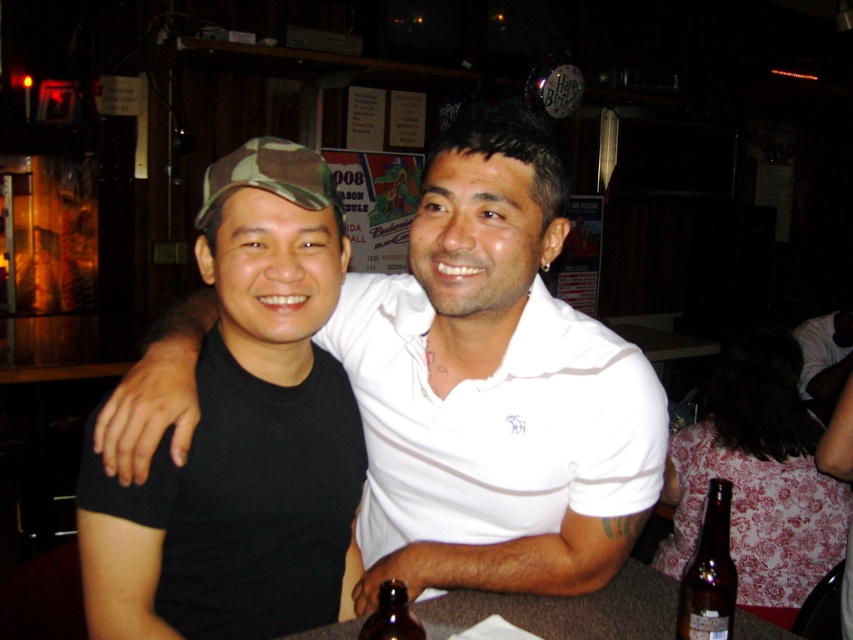
You are taking a photo of the scene and want to focus on both the point at (248, 248) and the point at (399, 621). Which point should you adjust your focus to first to ensure both are in clear view?

You should focus on point (248, 248) first because it is closer to the camera than point (399, 621). This way, adjusting focus from the closer point outward will help both points come into focus.

You are at a birthday party and see a black matte cap at left and a brown glass bottle at lower center. Which object is located to the left of the other?

The black matte cap at left is positioned on the left side of brown glass bottle at lower center.

You are designing a layout for a magazine article about the image. The editor wants to highlight the black matte shirt at center and the black matte cap at left. Since the two objects are both black and matte, how can you visually distinguish them in the layout?

The black matte shirt at center has a greater height compared to the black matte cap at left, so you can emphasize the size difference by scaling the shirt image slightly larger than the cap in the layout to reflect their actual sizes.